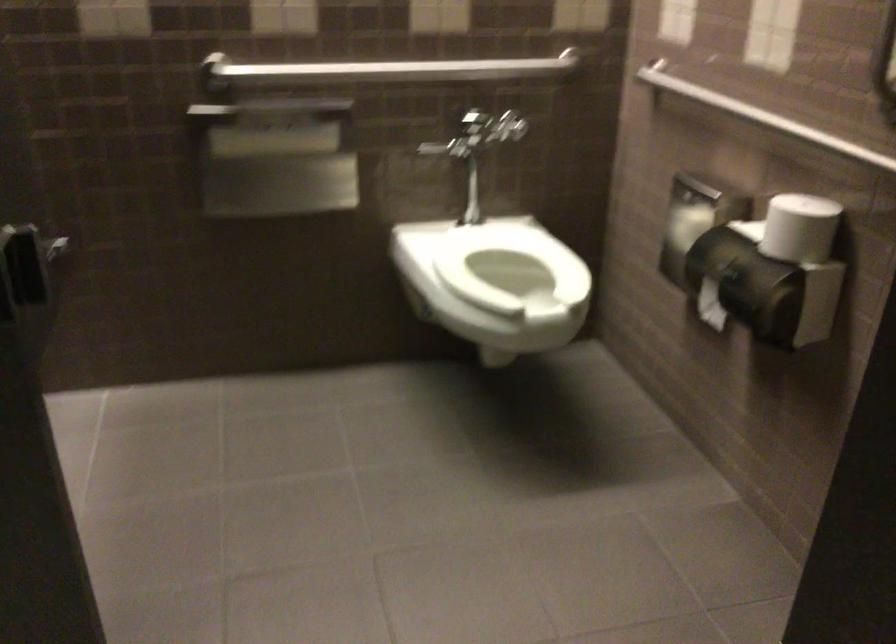
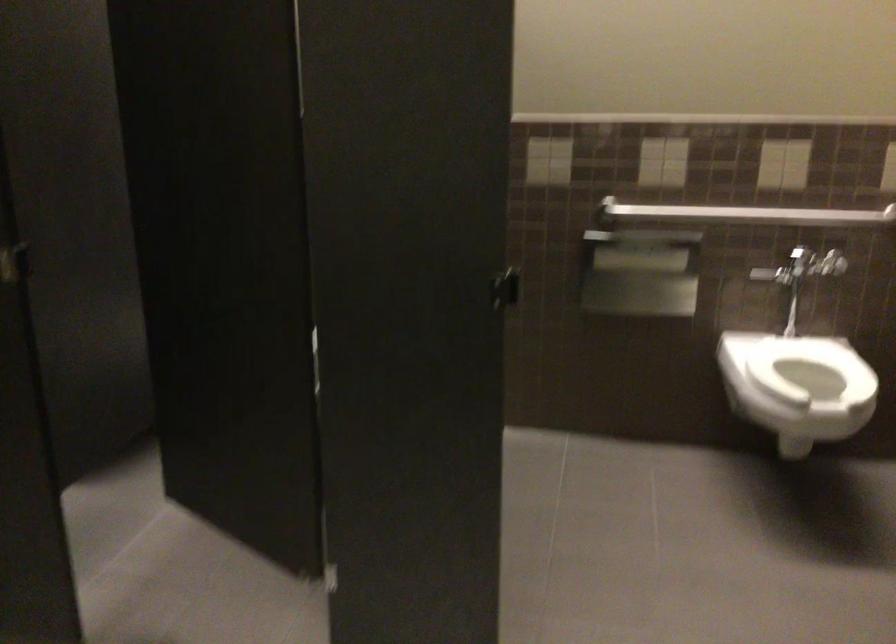
Locate, in the second image, the point that corresponds to (x=395, y=73) in the first image.

(745, 214)